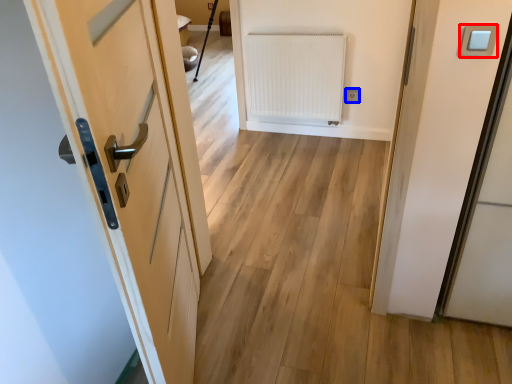
Question: Which object appears closest to the camera in this image, light switch (highlighted by a red box) or electric outlet (highlighted by a blue box)?

Choices:
 (A) light switch
 (B) electric outlet

Answer: (A)